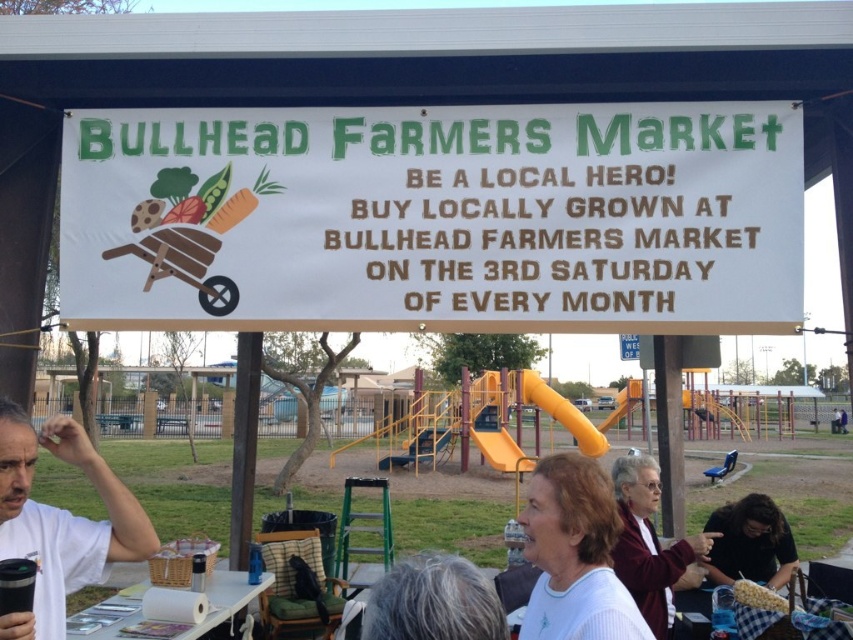
Is gray hair at upper center taller than dark brown hair at lower right?

Incorrect, gray hair at upper center's height is not larger of dark brown hair at lower right's.

Can you confirm if gray hair at upper center is positioned to the right of dark brown hair at lower right?

Incorrect, gray hair at upper center is not on the right side of dark brown hair at lower right.

Locate an element on the screen. This screenshot has width=853, height=640. gray hair at upper center is located at coordinates (433, 602).

Is white t-shirt at left above golden corn cob at lower right?

Yes, white t-shirt at left is above golden corn cob at lower right.

Is white t-shirt at left positioned behind golden corn cob at lower right?

No, it is not.

You are a GUI agent. You are given a task and a screenshot of the screen. Output one action in this format:
    pyautogui.click(x=<x>, y=<y>)
    Task: Click on the white t-shirt at left
    
    Given the screenshot: What is the action you would take?
    pyautogui.click(x=61, y=520)

Is white striped shirt at lower center smaller than dark brown hair at lower right?

Actually, white striped shirt at lower center might be larger than dark brown hair at lower right.

Does point (527, 513) come farther from viewer compared to point (724, 582)?

No, it is not.

Who is more distant from viewer, (556, 554) or (778, 547)?

Point (778, 547)

Locate an element on the screen. The image size is (853, 640). white striped shirt at lower center is located at coordinates (575, 554).